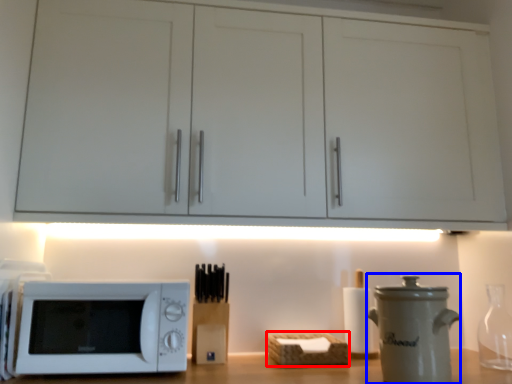
Question: Which object appears farthest to the camera in this image, basket (highlighted by a red box) or appliance (highlighted by a blue box)?

Choices:
 (A) basket
 (B) appliance

Answer: (A)